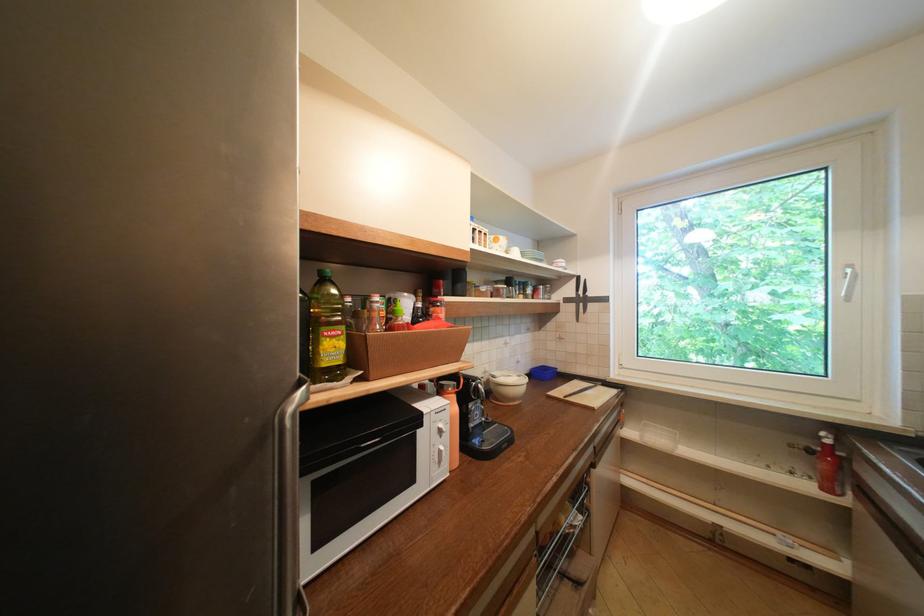
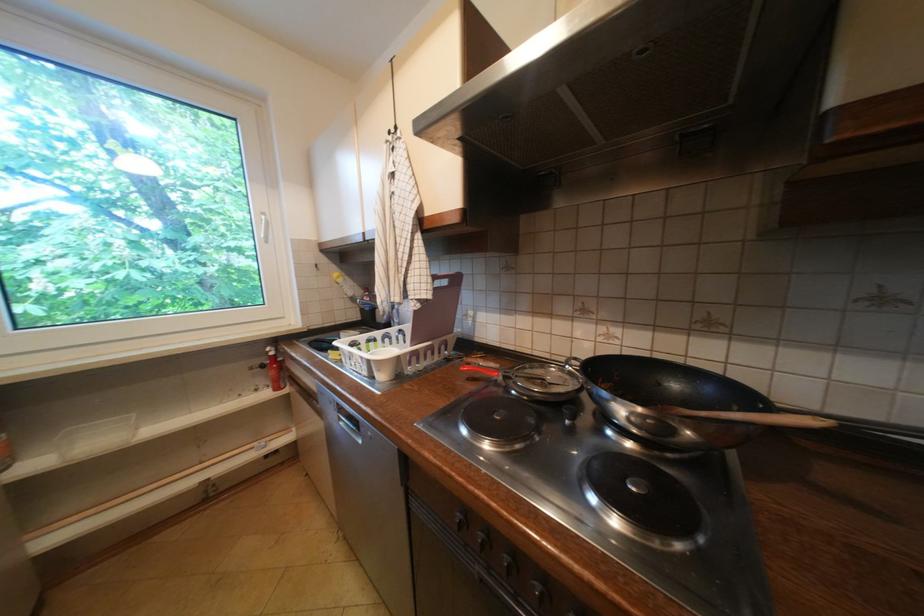
Question: Based on the continuous images, in which direction is the camera rotating? Reply with the corresponding letter.

Choices:
 (A) Left
 (B) Right
 (C) Up
 (D) Down

Answer: (B)